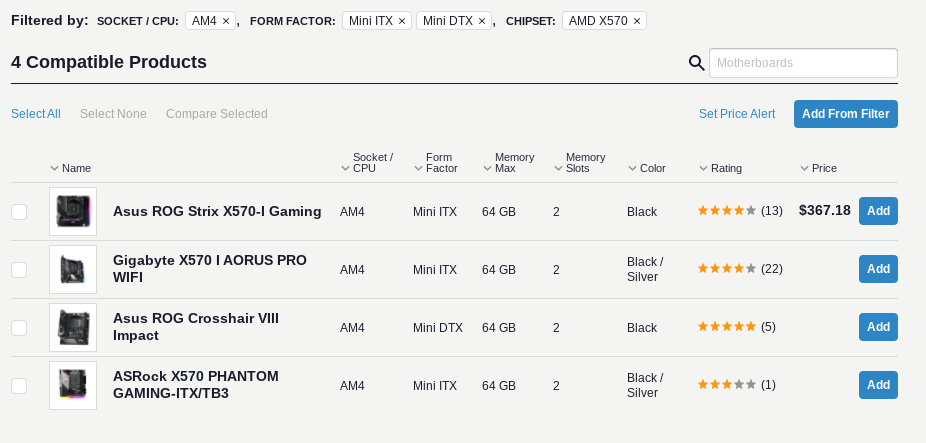
Locate an element on the screen. This screenshot has width=926, height=443. box is located at coordinates (206, 16), (367, 20), (454, 15), (577, 17).